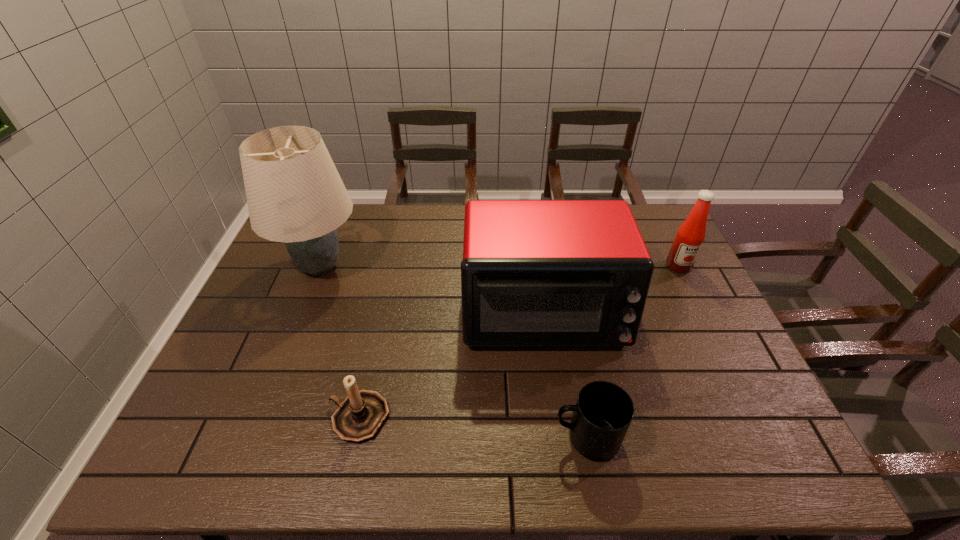
You are a GUI agent. You are given a task and a screenshot of the screen. Output one action in this format:
    pyautogui.click(x=<x>, y=<y>)
    Task: Click on the free space between the mug and the toaster oven
    
    Given the screenshot: What is the action you would take?
    coord(564,375)

At what (x,y) coordinates should I click in order to perform the action: click on the third closest object to the fourth object from right to left. Please return your answer as a coordinate pair (x, y). Looking at the image, I should click on (602, 415).

Identify the location of object that ranks as the second closest to the fourth object from right to left. The image size is (960, 540). click(295, 195).